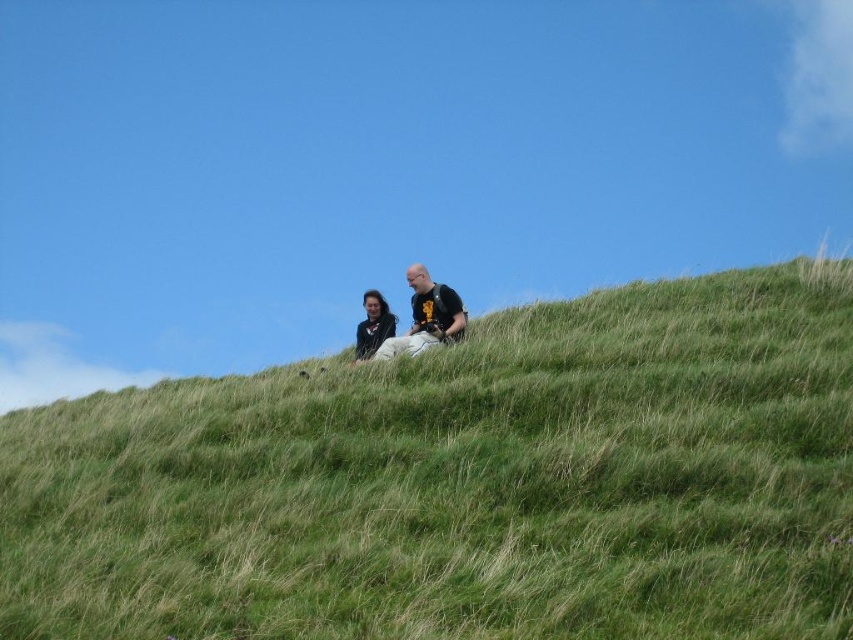
Question: Which object is the closest to the green grassy hillside at upper center?

Choices:
 (A) black matte shirt at center
 (B) smooth black jacket at center

Answer: (A)

Question: Is the position of black matte shirt at center less distant than that of smooth black jacket at center?

Choices:
 (A) no
 (B) yes

Answer: (B)

Question: Is the position of black matte shirt at center more distant than that of smooth black jacket at center?

Choices:
 (A) yes
 (B) no

Answer: (B)

Question: Considering the relative positions of green grassy hillside at upper center and smooth black jacket at center in the image provided, where is green grassy hillside at upper center located with respect to smooth black jacket at center?

Choices:
 (A) above
 (B) below

Answer: (B)

Question: Estimate the real-world distances between objects in this image. Which object is farther from the smooth black jacket at center?

Choices:
 (A) black matte shirt at center
 (B) green grassy hillside at upper center

Answer: (B)

Question: Estimate the real-world distances between objects in this image. Which object is closer to the smooth black jacket at center?

Choices:
 (A) green grassy hillside at upper center
 (B) black matte shirt at center

Answer: (B)